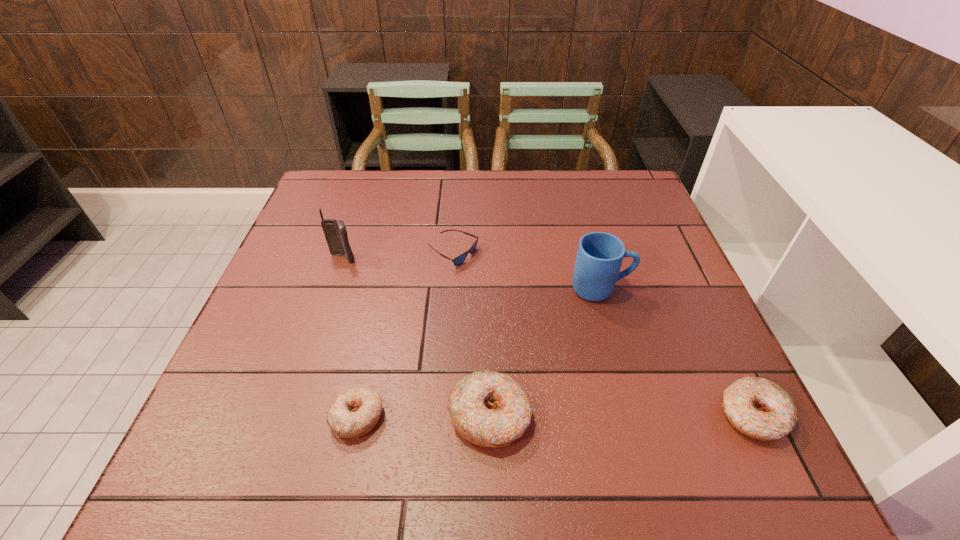
The image size is (960, 540). In the image, there is a desktop. What are the coordinates of `vacant space at the far edge` in the screenshot? It's located at pyautogui.click(x=465, y=184).

You are a GUI agent. You are given a task and a screenshot of the screen. Output one action in this format:
    pyautogui.click(x=<x>, y=<y>)
    Task: Click on the free space at the near edge of the desktop
    This screenshot has height=540, width=960.
    Given the screenshot: What is the action you would take?
    pyautogui.click(x=626, y=385)

This screenshot has height=540, width=960. In the image, there is a desktop. In order to click on free space at the left edge in this screenshot , I will do `click(287, 279)`.

Where is `free space at the right edge of the desktop`? free space at the right edge of the desktop is located at coordinates (650, 334).

Locate an element on the screen. vacant space at the far left corner of the desktop is located at coordinates (365, 178).

You are a GUI agent. You are given a task and a screenshot of the screen. Output one action in this format:
    pyautogui.click(x=<x>, y=<y>)
    Task: Click on the vacant space at the near left corner of the desktop
    The height and width of the screenshot is (540, 960).
    Given the screenshot: What is the action you would take?
    pyautogui.click(x=214, y=401)

Find the location of `free spot between the third farthest object and the tallest doughnut`. free spot between the third farthest object and the tallest doughnut is located at coordinates (545, 353).

At what (x,y) coordinates should I click in order to perform the action: click on vacant area between the rightmost doughnut and the fourth nearest object. Please return your answer as a coordinate pair (x, y). Looking at the image, I should click on (677, 352).

The width and height of the screenshot is (960, 540). In order to click on vacant space in between the sunglasses and the fourth nearest object in this screenshot , I will do `click(527, 271)`.

What are the coordinates of `free space that is in between the cellular telephone and the sunglasses` in the screenshot? It's located at (398, 256).